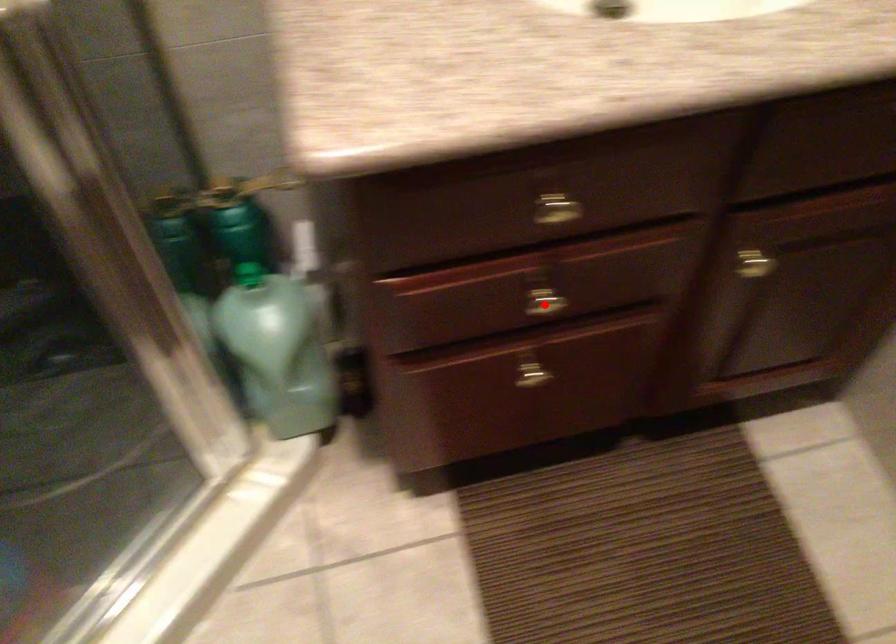
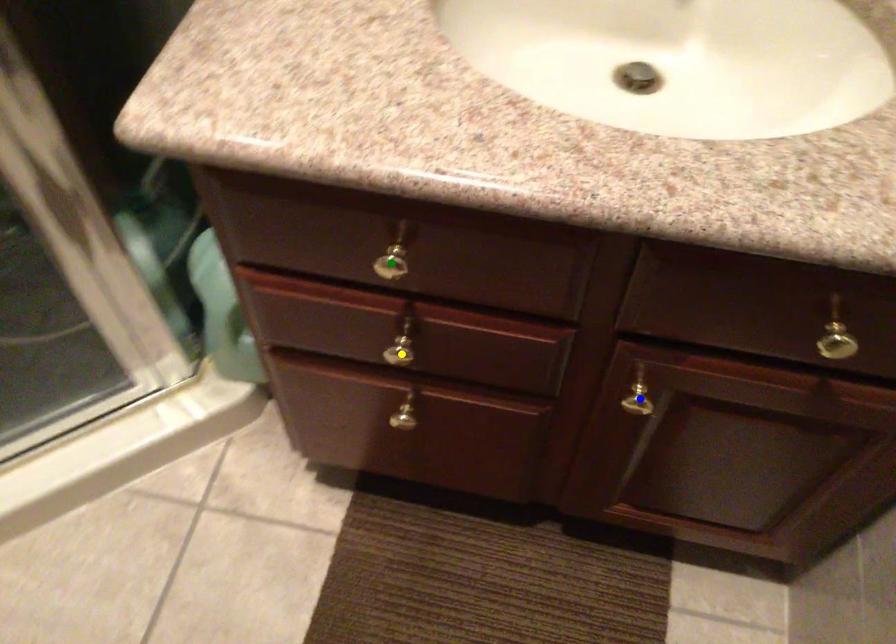
Question: I am providing you with two images of the same scene from different viewpoints. A red point is marked on the first image. You are given multiple points on the second image. In image 2, which mark is for the same physical point as the one in image 1?

Choices:
 (A) green point
 (B) blue point
 (C) yellow point

Answer: (C)